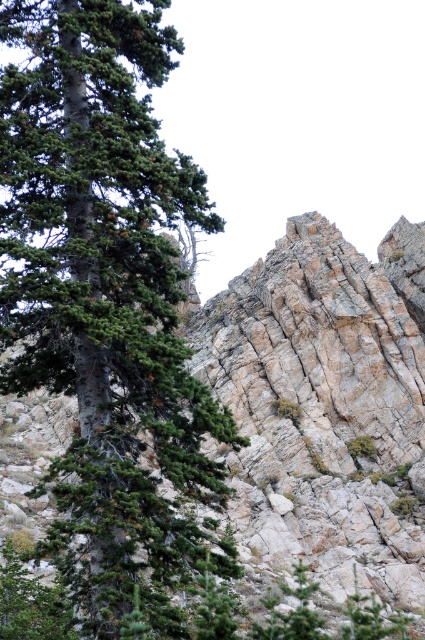
Locate an element on the screen. Image resolution: width=425 pixels, height=640 pixels. green matte tree at left is located at coordinates (105, 298).

Between green matte tree at left and rugged stone mountain at center, which one is positioned lower?

Positioned lower is rugged stone mountain at center.

Is point (159, 563) closer to camera compared to point (339, 376)?

Yes, point (159, 563) is closer to viewer.

You are a GUI agent. You are given a task and a screenshot of the screen. Output one action in this format:
    pyautogui.click(x=<x>, y=<y>)
    Task: Click on the green matte tree at left
    
    Given the screenshot: What is the action you would take?
    pyautogui.click(x=105, y=298)